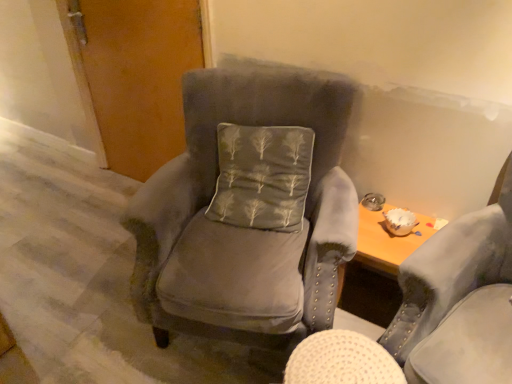
Question: From the image's perspective, is matte wood door at upper left over satin gray pillow at center?

Choices:
 (A) no
 (B) yes

Answer: (B)

Question: Can you see matte wood door at upper left touching satin gray pillow at center?

Choices:
 (A) yes
 (B) no

Answer: (B)

Question: Is matte wood door at upper left surrounding satin gray pillow at center?

Choices:
 (A) no
 (B) yes

Answer: (A)

Question: From the image's perspective, is matte wood door at upper left located beneath satin gray pillow at center?

Choices:
 (A) yes
 (B) no

Answer: (B)

Question: Considering the relative sizes of matte wood door at upper left and satin gray pillow at center in the image provided, is matte wood door at upper left wider than satin gray pillow at center?

Choices:
 (A) yes
 (B) no

Answer: (B)

Question: From a real-world perspective, is satin gray pillow at center physically located above or below matte wood door at upper left?

Choices:
 (A) below
 (B) above

Answer: (B)

Question: Is satin gray pillow at center situated inside matte wood door at upper left or outside?

Choices:
 (A) inside
 (B) outside

Answer: (B)

Question: Does point (282, 152) appear closer or farther from the camera than point (138, 107)?

Choices:
 (A) closer
 (B) farther

Answer: (A)

Question: Is satin gray pillow at center bigger or smaller than matte wood door at upper left?

Choices:
 (A) big
 (B) small

Answer: (B)

Question: Is velvet gray armchair at center, which ranks as the 1th chair in right-to-left order, inside or outside of satin gray pillow at center?

Choices:
 (A) inside
 (B) outside

Answer: (B)

Question: From the image's perspective, is velvet gray armchair at center, which ranks as the 1th chair in right-to-left order, positioned above or below satin gray pillow at center?

Choices:
 (A) above
 (B) below

Answer: (B)

Question: Is velvet gray armchair at center, which ranks as the 1th chair in right-to-left order, bigger or smaller than satin gray pillow at center?

Choices:
 (A) small
 (B) big

Answer: (B)

Question: Is point [x=431, y=322] closer or farther from the camera than point [x=252, y=225]?

Choices:
 (A) farther
 (B) closer

Answer: (B)

Question: From the image's perspective, is matte wood door at upper left positioned above or below satin gray pillow at center?

Choices:
 (A) above
 (B) below

Answer: (A)

Question: Choose the correct answer: Is matte wood door at upper left inside satin gray pillow at center or outside it?

Choices:
 (A) outside
 (B) inside

Answer: (A)